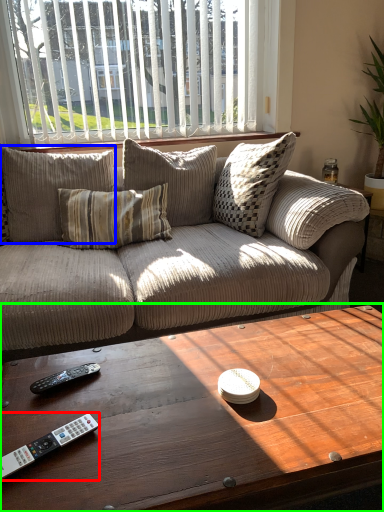
Question: Based on their relative distances, which object is farther from remote control (highlighted by a red box)? Choose from pillow (highlighted by a blue box) and coffee table (highlighted by a green box).

Choices:
 (A) pillow
 (B) coffee table

Answer: (A)